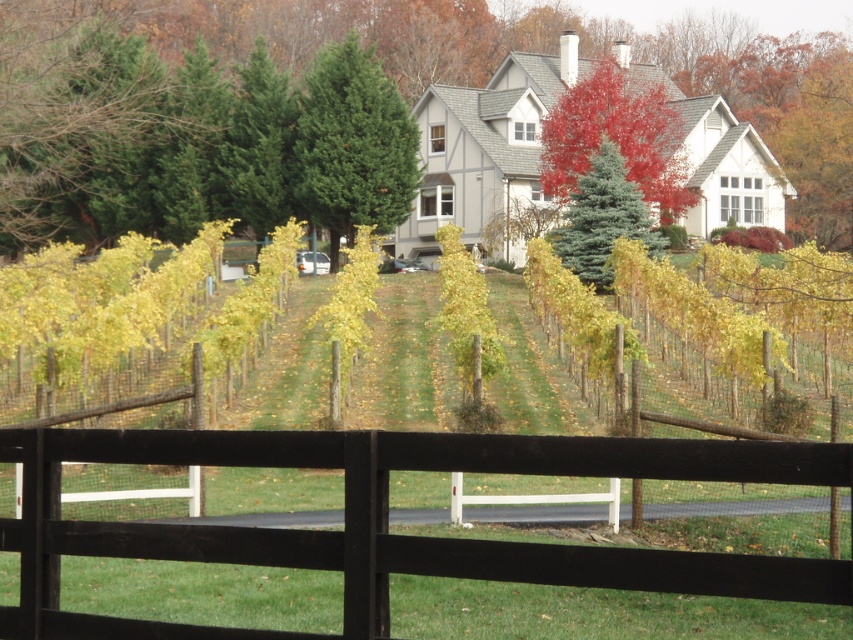
You are standing at the point with coordinates point [386,72] in the image. What object are you looking at?

The point [386,72] corresponds to the green leafy tree at upper center.

You are a gardener planning to prune the trees in the vineyard. You notice the green leafy tree at upper center and the red glossy tree at upper center. Which tree requires more attention for pruning due to its size?

The green leafy tree at upper center requires more attention for pruning because it is bigger than the red glossy tree at upper center.

You are standing at the entrance of the vineyard and see the green leafy tree at upper center and the green textured tree at center. Which tree is positioned higher in the image?

The green leafy tree at upper center is positioned higher in the image than the green textured tree at center.